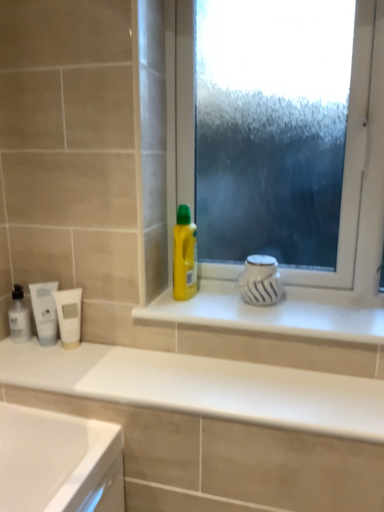
Question: Is point (13, 300) closer or farther from the camera than point (72, 323)?

Choices:
 (A) farther
 (B) closer

Answer: (A)

Question: Considering the relative positions of translucent plastic mouthwash at left, which is the third mouthwash in right-to-left order, and white matte tube at lower left, the 1th mouthwash from the right, in the image provided, is translucent plastic mouthwash at left, which is the third mouthwash in right-to-left order, to the left or to the right of white matte tube at lower left, the 1th mouthwash from the right,?

Choices:
 (A) left
 (B) right

Answer: (A)

Question: Considering the real-world distances, which object is farthest from the white glossy counter top at lower center?

Choices:
 (A) translucent plastic mouthwash at left, which is counted as the first mouthwash, starting from the left
 (B) yellow plastic bottle at center
 (C) white matte tube at lower left, which is the third mouthwash in left-to-right order
 (D) white matte tube at left, the second mouthwash viewed from the left
 (E) white glossy window sill at center

Answer: (A)

Question: Which object is the farthest from the yellow plastic bottle at center?

Choices:
 (A) frosted glass window at center
 (B) translucent plastic mouthwash at left, which is counted as the first mouthwash, starting from the left
 (C) white glossy window sill at center
 (D) white glossy counter top at lower center
 (E) white matte tube at left, the second mouthwash viewed from the left

Answer: (B)